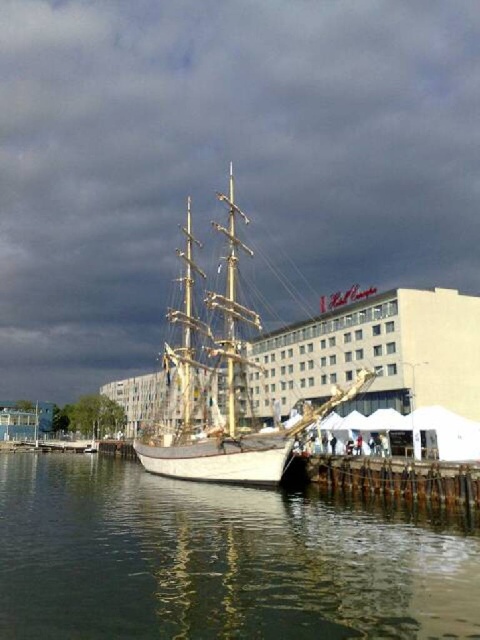
Can you confirm if white wooden ship at center is bigger than wooden at lower right?

Indeed, white wooden ship at center has a larger size compared to wooden at lower right.

Can you confirm if white wooden ship at center is taller than wooden at lower right?

Correct, white wooden ship at center is much taller as wooden at lower right.

Who is more distant from viewer, (191,444) or (397,461)?

The point (191,444) is more distant.

Locate an element on the screen. The image size is (480, 640). white wooden ship at center is located at coordinates (220, 385).

Is clear water at lower center to the left of white wooden ship at center from the viewer's perspective?

Incorrect, clear water at lower center is not on the left side of white wooden ship at center.

This screenshot has width=480, height=640. Describe the element at coordinates (217, 561) in the screenshot. I see `clear water at lower center` at that location.

This screenshot has height=640, width=480. I want to click on clear water at lower center, so click(x=217, y=561).

What do you see at coordinates (217, 561) in the screenshot? I see `clear water at lower center` at bounding box center [217, 561].

Is clear water at lower center to the left of wooden at lower right from the viewer's perspective?

Correct, you'll find clear water at lower center to the left of wooden at lower right.

Between point (394, 608) and point (414, 472), which one is positioned in front?

Point (394, 608) is in front.

Find the location of `clear water at lower center`. clear water at lower center is located at coordinates (217, 561).